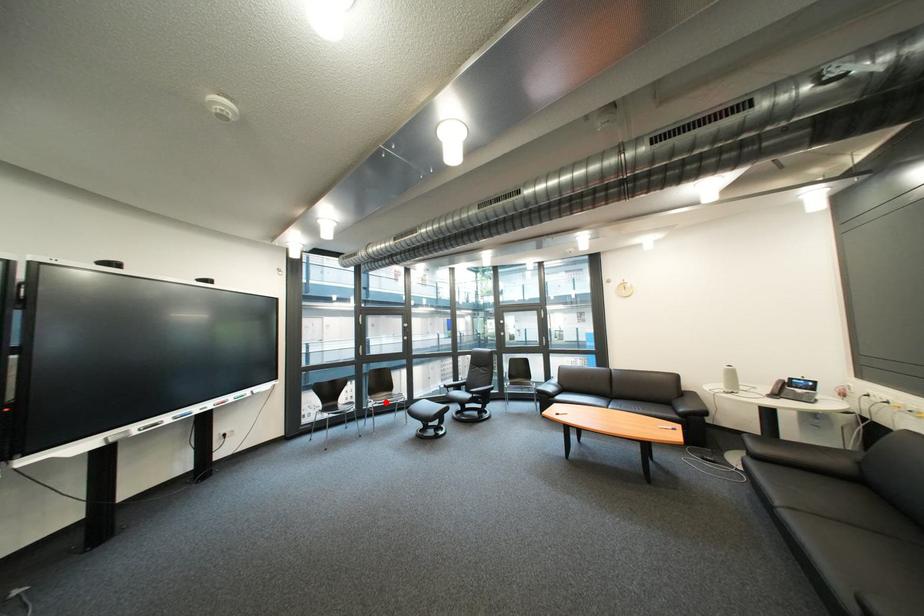
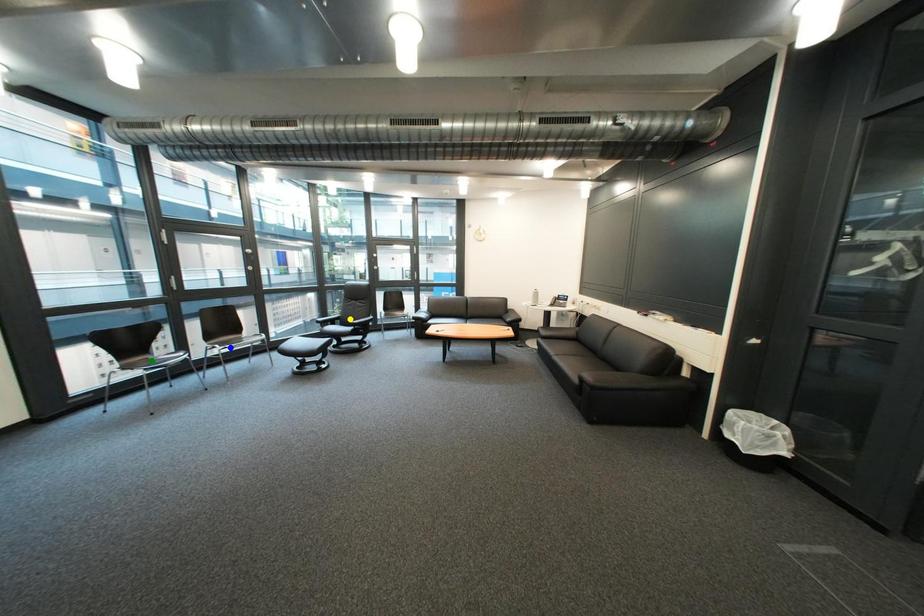
Question: I am providing you with two images of the same scene from different viewpoints. A red point is marked on the first image. You are given multiple points on the second image. Can you choose the point in image 2 that corresponds to the point in image 1?

Choices:
 (A) green point
 (B) blue point
 (C) yellow point

Answer: (B)